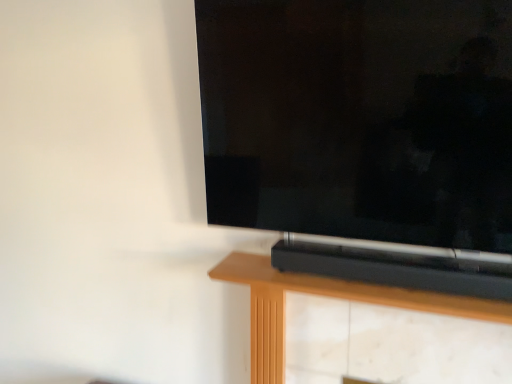
What do you see at coordinates (364, 136) in the screenshot? This screenshot has height=384, width=512. I see `matte black tv at center` at bounding box center [364, 136].

The width and height of the screenshot is (512, 384). Find the location of `matte black tv at center`. matte black tv at center is located at coordinates (364, 136).

I want to click on black plastic soundbar at center, so click(x=326, y=296).

What do you see at coordinates (326, 296) in the screenshot?
I see `black plastic soundbar at center` at bounding box center [326, 296].

The height and width of the screenshot is (384, 512). In order to click on matte black tv at center in this screenshot , I will do `click(364, 136)`.

Considering the relative positions of matte black tv at center and black plastic soundbar at center in the image provided, is matte black tv at center to the right of black plastic soundbar at center from the viewer's perspective?

No, matte black tv at center is not to the right of black plastic soundbar at center.

Is matte black tv at center positioned before black plastic soundbar at center?

Yes, the depth of matte black tv at center is less than that of black plastic soundbar at center.

Which is farther, (500, 22) or (346, 283)?

The point (346, 283) is farther.

From the image's perspective, who appears lower, matte black tv at center or black plastic soundbar at center?

black plastic soundbar at center appears lower in the image.

From a real-world perspective, does matte black tv at center sit lower than black plastic soundbar at center?

No, from a real-world perspective, matte black tv at center is not under black plastic soundbar at center.

Can you confirm if matte black tv at center is wider than black plastic soundbar at center?

No.

Is matte black tv at center shorter than black plastic soundbar at center?

No.

Considering the relative sizes of matte black tv at center and black plastic soundbar at center in the image provided, is matte black tv at center smaller than black plastic soundbar at center?

No.

Would you say matte black tv at center is inside or outside black plastic soundbar at center?

The correct answer is: outside.

Is matte black tv at center positioned far away from black plastic soundbar at center?

No.

Is matte black tv at center oriented away from black plastic soundbar at center?

No, matte black tv at center is not facing the opposite direction of black plastic soundbar at center.

The height and width of the screenshot is (384, 512). In order to click on furniture below the matte black tv at center (from a real-world perspective) in this screenshot , I will do `click(326, 296)`.

In the scene shown: Is black plastic soundbar at center to the right of matte black tv at center from the viewer's perspective?

Yes.

In the scene shown: Between black plastic soundbar at center and matte black tv at center, which one is positioned in front?

matte black tv at center is in front.

Does point (305, 278) appear closer or farther from the camera than point (421, 223)?

Point (305, 278) is farther from the camera than point (421, 223).

From the image's perspective, which is above, black plastic soundbar at center or matte black tv at center?

matte black tv at center appears higher in the image.

From a real-world perspective, is black plastic soundbar at center located beneath matte black tv at center?

Indeed, from a real-world perspective, black plastic soundbar at center is positioned beneath matte black tv at center.

Looking at their sizes, would you say black plastic soundbar at center is wider or thinner than matte black tv at center?

Clearly, black plastic soundbar at center has more width compared to matte black tv at center.

Considering the sizes of objects black plastic soundbar at center and matte black tv at center in the image provided, who is shorter, black plastic soundbar at center or matte black tv at center?

Standing shorter between the two is black plastic soundbar at center.

In terms of size, does black plastic soundbar at center appear bigger or smaller than matte black tv at center?

In the image, black plastic soundbar at center appears to be smaller than matte black tv at center.

Do you think black plastic soundbar at center is within matte black tv at center, or outside of it?

black plastic soundbar at center is located beyond the bounds of matte black tv at center.

Are black plastic soundbar at center and matte black tv at center located far from each other?

No, black plastic soundbar at center is not far away from matte black tv at center.

Is black plastic soundbar at center facing towards matte black tv at center?

No, black plastic soundbar at center is not oriented towards matte black tv at center.

Can you tell me how much black plastic soundbar at center and matte black tv at center differ in facing direction?

There is a 0.156-degree angle between the facing directions of black plastic soundbar at center and matte black tv at center.

At what (x,y) coordinates should I click in order to perform the action: click on furniture lying on the right of matte black tv at center. Please return your answer as a coordinate pair (x, y). The width and height of the screenshot is (512, 384). Looking at the image, I should click on (326, 296).

The image size is (512, 384). Find the location of `furniture directly beneath the matte black tv at center (from a real-world perspective)`. furniture directly beneath the matte black tv at center (from a real-world perspective) is located at coordinates (326, 296).

You are a GUI agent. You are given a task and a screenshot of the screen. Output one action in this format:
    pyautogui.click(x=<x>, y=<y>)
    Task: Click on the furniture behind the matte black tv at center
    This screenshot has height=384, width=512.
    Given the screenshot: What is the action you would take?
    pyautogui.click(x=326, y=296)